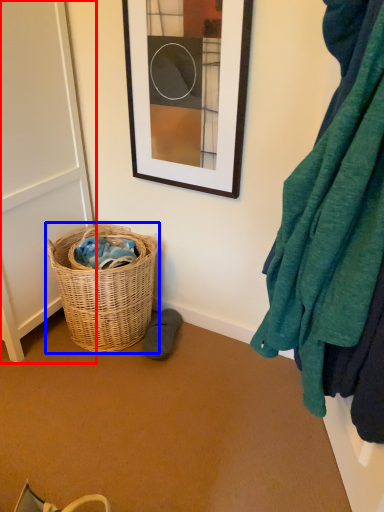
Question: Which point is further to the camera, screen door (highlighted by a red box) or picnic basket (highlighted by a blue box)?

Choices:
 (A) screen door
 (B) picnic basket

Answer: (B)